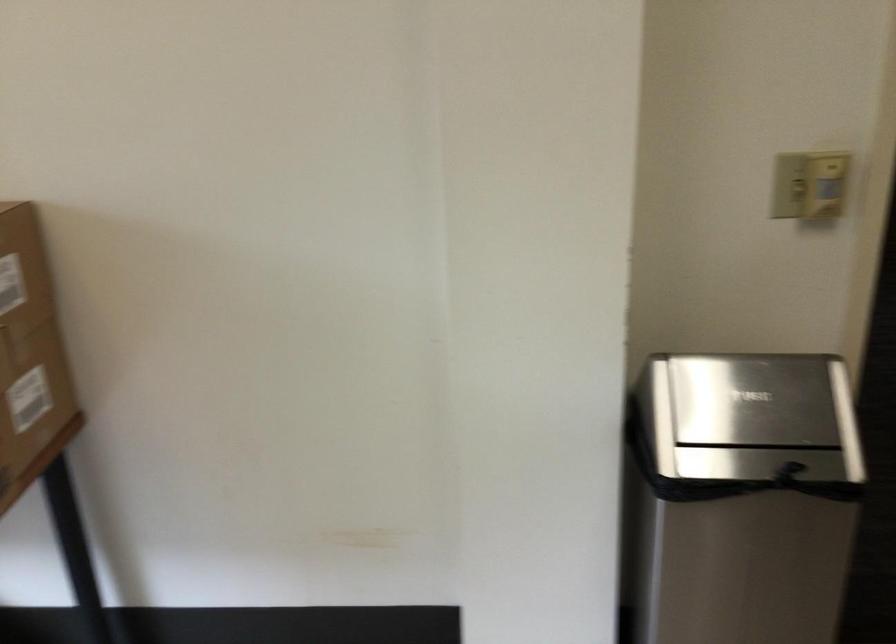
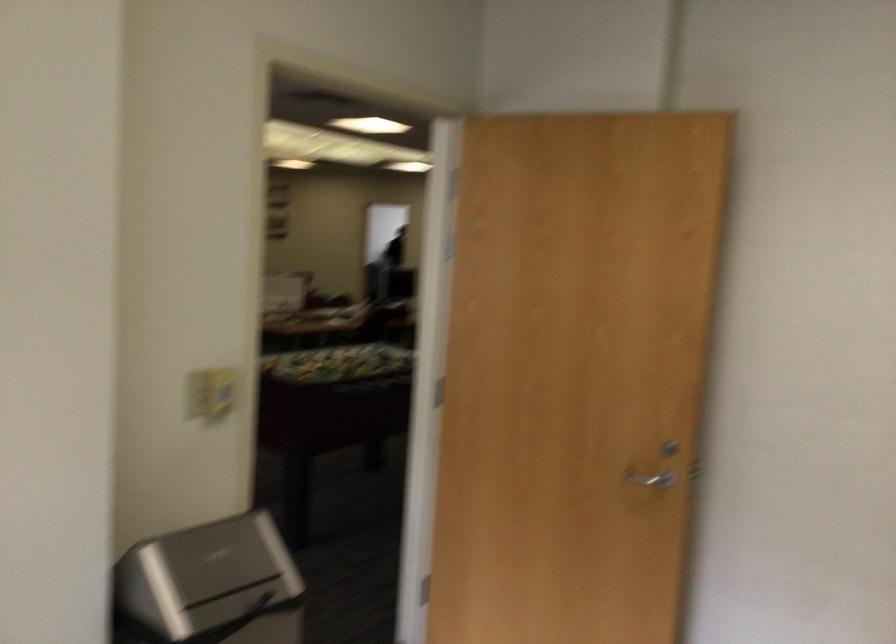
Where in the second image is the point corresponding to pixel 800 184 from the first image?

(209, 393)